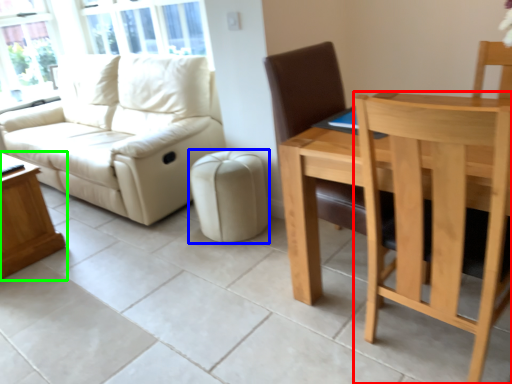
Question: Which object is positioned farthest from chair (highlighted by a red box)? Select from stool (highlighted by a blue box) and table (highlighted by a green box).

Choices:
 (A) stool
 (B) table

Answer: (B)